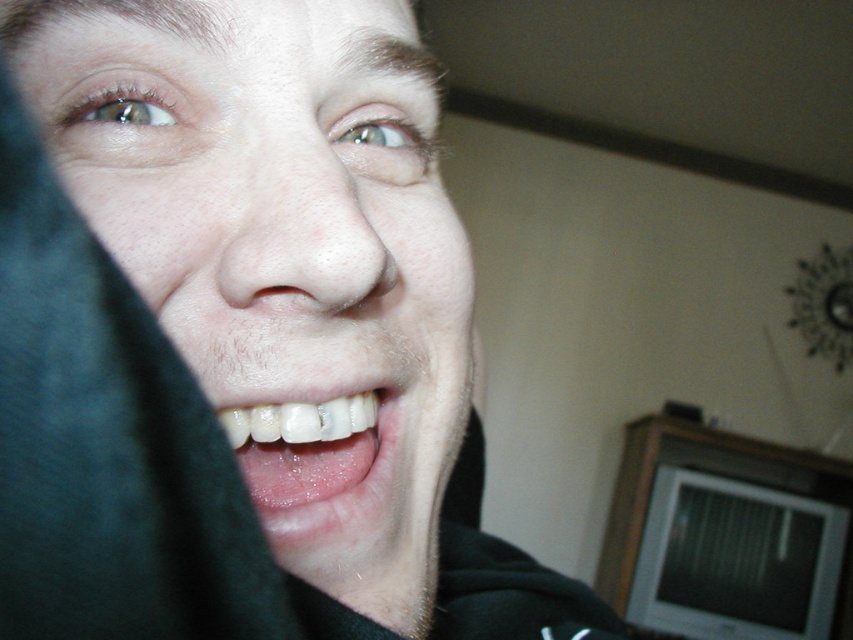
You are taking a photo of the person in the scene. You want to focus on the point that is closer to the camera. Which point should you choose between point (x=386, y=291) and point (x=282, y=438)?

You should focus on point (x=386, y=291) because it is closer to the camera than point (x=282, y=438).

You are a photographer adjusting lighting for a portrait. You need to ensure the matte black face at center and white glossy teeth at center are both visible. Which object requires more fill light to avoid underexposure?

The matte black face at center is taller than white glossy teeth at center, so it requires more fill light to avoid underexposure because darker, larger areas often need additional lighting to balance exposure with brighter, smaller regions.

You are an artist trying to sketch this scene. You need to place the matte black face at center and the white glossy teeth at center accurately. Based on the description, which object should be positioned to the right of the other?

The matte black face at center is to the right of white glossy teeth at center, so the matte black face at center should be placed to the right of the white glossy teeth at center.